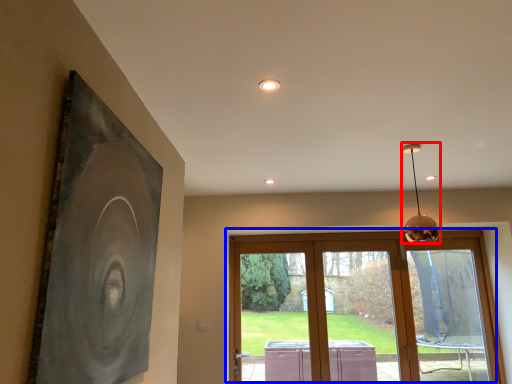
Question: Among these objects, which one is nearest to the camera, lamp (highlighted by a red box) or window (highlighted by a blue box)?

Choices:
 (A) lamp
 (B) window

Answer: (A)